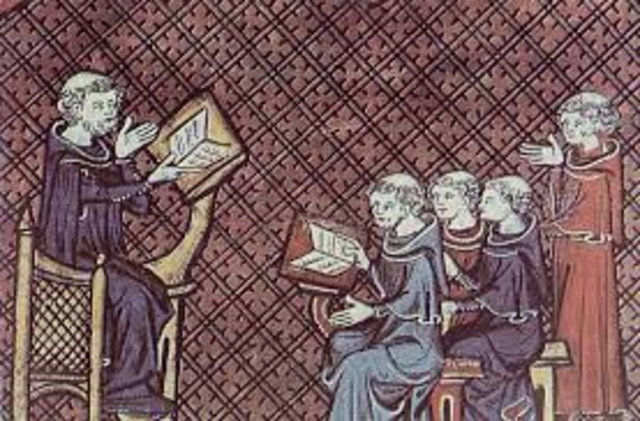
Identify the location of robe. (76, 192), (403, 354), (472, 256), (500, 255), (592, 208).